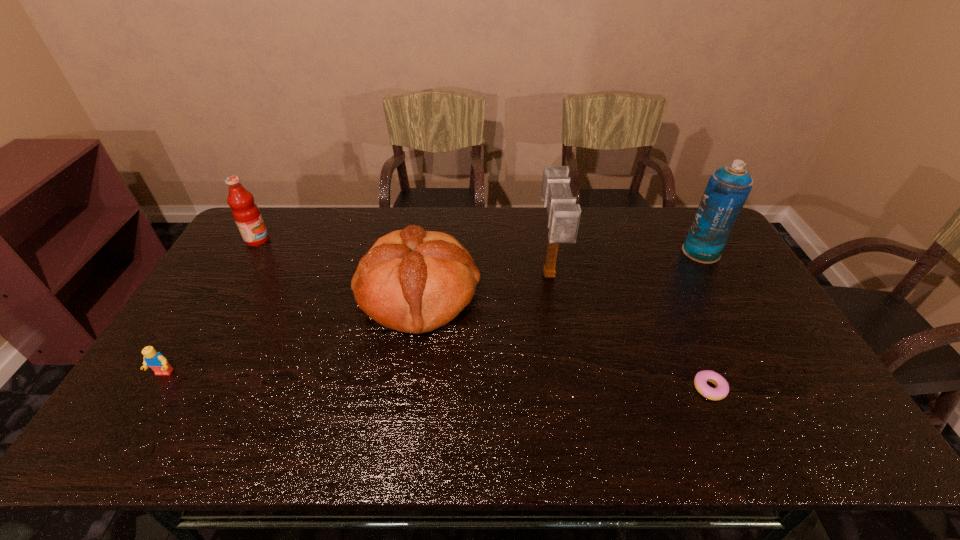
Locate an element on the screen. Image resolution: width=960 pixels, height=540 pixels. vacant space located on the front label of the fourth shortest object is located at coordinates (283, 240).

The height and width of the screenshot is (540, 960). I want to click on vacant region located 0.200m on the front of the bread, so click(402, 408).

Find the location of a particular element. Image resolution: width=960 pixels, height=540 pixels. vacant point located 0.140m on the front-facing side of the Lego is located at coordinates (129, 430).

The width and height of the screenshot is (960, 540). What are the coordinates of `free space located on the left of the doughnut` in the screenshot? It's located at (650, 389).

This screenshot has width=960, height=540. What are the coordinates of `aerosol can that is at the far edge` in the screenshot? It's located at (727, 190).

Identify the location of fruit juice located at the far edge. (246, 213).

Identify the location of fruit juice that is at the left edge. (246, 213).

Image resolution: width=960 pixels, height=540 pixels. Identify the location of Lego situated at the left edge. (155, 360).

The height and width of the screenshot is (540, 960). I want to click on object located in the right edge section of the desktop, so click(x=727, y=190).

Find the location of `object present at the far left corner`. object present at the far left corner is located at coordinates (246, 213).